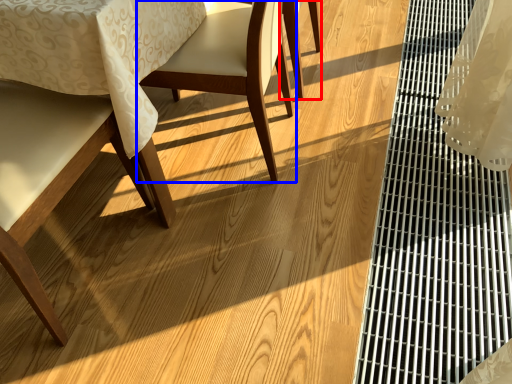
Question: Which of the following is the farthest to the observer, chair (highlighted by a red box) or chair (highlighted by a blue box)?

Choices:
 (A) chair
 (B) chair

Answer: (A)